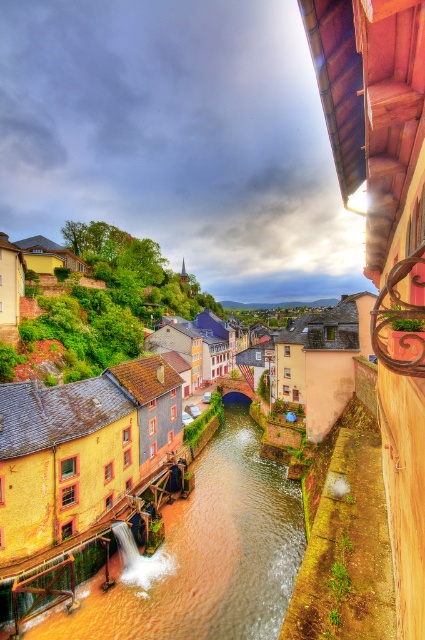
You are standing at the riverside and want to take a photo of the yellow matte building at center. Since the brown smooth water at lower center is in the way, where should you position yourself to avoid it?

The brown smooth water at lower center is located below the yellow matte building at center, so you should position yourself higher or to the side to avoid the water obstructing the view of the yellow matte building at center.

From the picture: You are standing in the riverside town and want to take a photo of both point (x=190, y=508) and point (x=150, y=413). Which point should you focus on first to ensure both are in clear view?

Point (x=190, y=508) is closer to the camera than point (x=150, y=413). To ensure both are in clear view, focus on point (x=190, y=508) first as it is nearer, allowing the camera to adjust the depth of field to include the farther point.